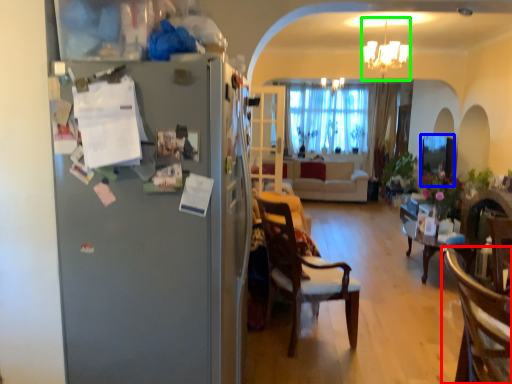
Question: Based on their relative distances, which object is nearer to chair (highlighted by a red box)? Choose from window screen (highlighted by a blue box) and light fixture (highlighted by a green box).

Choices:
 (A) window screen
 (B) light fixture

Answer: (A)